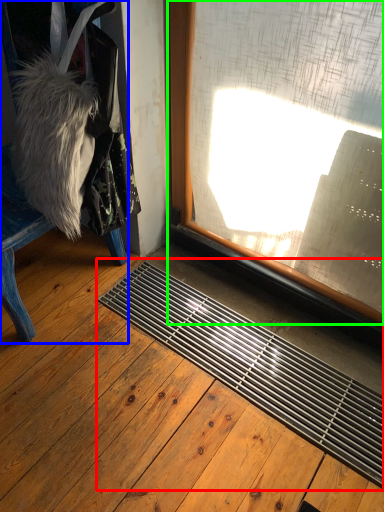
Question: Which is nearer to the doormat (highlighted by a red box)? furniture (highlighted by a blue box) or window (highlighted by a green box).

Choices:
 (A) furniture
 (B) window

Answer: (B)